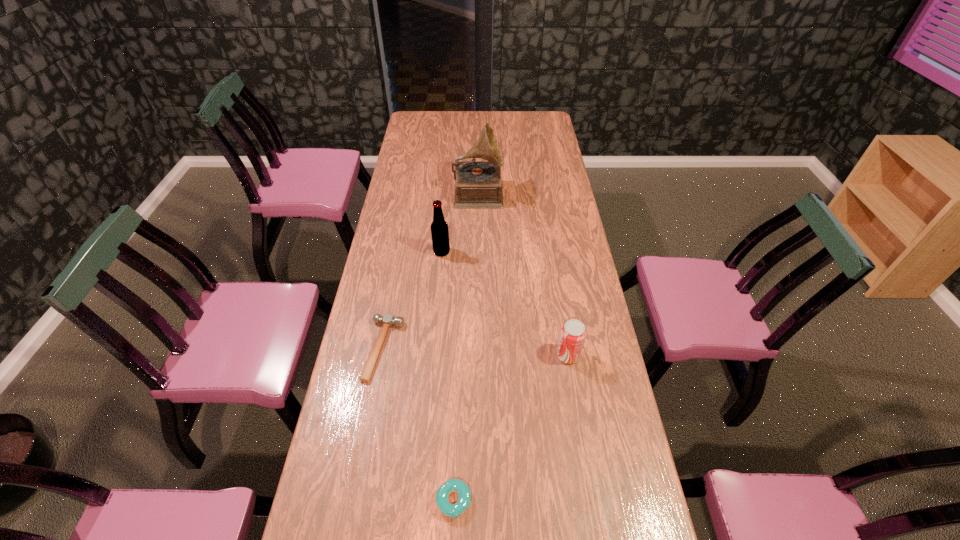
The image size is (960, 540). I want to click on the farthest object, so click(x=478, y=185).

The width and height of the screenshot is (960, 540). Find the location of `the tallest object`. the tallest object is located at coordinates (478, 185).

This screenshot has height=540, width=960. I want to click on the second tallest object, so click(x=439, y=228).

Find the location of a particular element. beer bottle is located at coordinates (439, 228).

The width and height of the screenshot is (960, 540). Identify the location of the rightmost object. (573, 333).

Where is `the third tallest object`? This screenshot has width=960, height=540. the third tallest object is located at coordinates (573, 333).

The image size is (960, 540). I want to click on hammer, so click(388, 320).

You are a GUI agent. You are given a task and a screenshot of the screen. Output one action in this format:
    pyautogui.click(x=<x>, y=<y>)
    Task: Click on the doughnut
    This screenshot has width=960, height=540.
    Given the screenshot: What is the action you would take?
    pyautogui.click(x=452, y=485)

Locate an element on the screen. free spot located from the horn of the tallest object is located at coordinates (556, 191).

Find the location of a particular element. Image resolution: width=960 pixels, height=540 pixels. free spot located 0.120m on the back of the beer bottle is located at coordinates (444, 227).